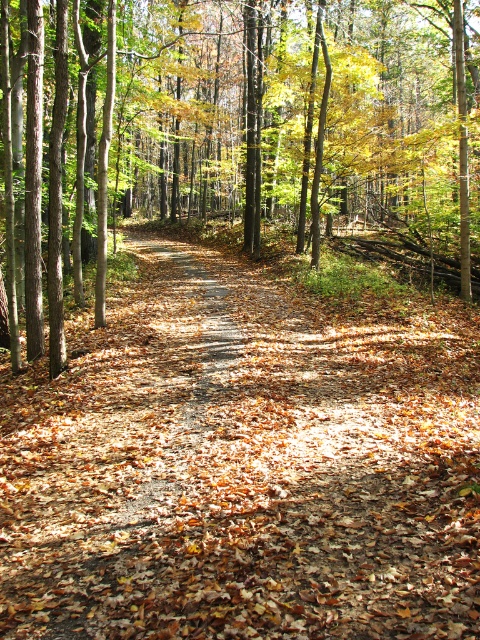
You are a hiker carrying a backpack and need to walk along the path. Considering the brown leafy forest path at center and the brown leaf litter at center, which one is wider and therefore safer to walk on?

The brown leaf litter at center is wider than the brown leafy forest path at center, so it is safer to walk on the brown leaf litter at center.

You are a hiker who wants to walk along the brown leafy forest path at center. However, you notice the brown leaf litter at center might be an obstacle. Based on their height, which one is taller and could potentially block your view?

The brown leaf litter at center is taller than the brown leafy forest path at center, so it might block your view.